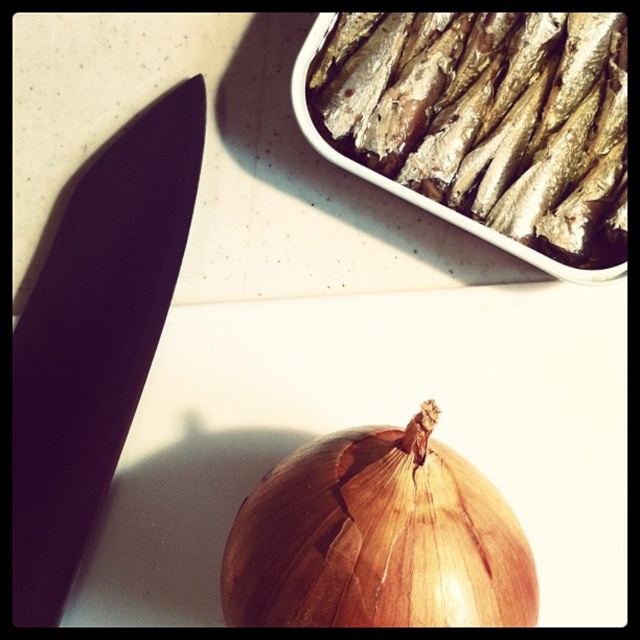
You are a chef preparing a dish and need to move from the shiny silver fish at upper right to the brown matte onion at bottom center on the kitchen countertop. Considering the distance between them, can you estimate how many steps you would need to take if each step covers approximately 30 centimeters?

The distance between the shiny silver fish at upper right and the brown matte onion at bottom center is 42.45 centimeters. Since each step covers about 30 centimeters, you would need approximately 2 steps to cover the distance between them.

You are a chef trying to arrange ingredients on a kitchen counter. You have two points marked on the counter, point A at coordinates point(406, 88) and point B at coordinates point(257, 518). Which point is closer to you when standing at the counter?

Point A at coordinates point(406, 88) is closer to you because it is further to the viewer than point B at coordinates point(257, 518).